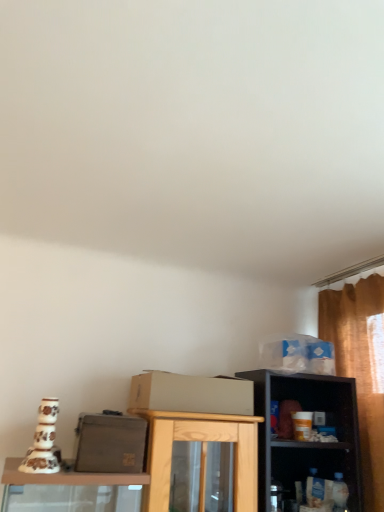
Question: From the image's perspective, is white plastic shelf at lower right positioned above or below beige cardboard box at center?

Choices:
 (A) below
 (B) above

Answer: (A)

Question: From a real-world perspective, relative to beige cardboard box at center, is white plastic shelf at lower right vertically above or below?

Choices:
 (A) below
 (B) above

Answer: (A)

Question: Which object is positioned farthest from the beige cardboard box at center?

Choices:
 (A) blue plastic bag at upper right, placed as the 1th box when sorted from top to bottom
 (B) matte gray box at center, acting as the first box starting from the front
 (C) white plastic shelf at lower right

Answer: (C)

Question: Which object is positioned farthest from the blue plastic bag at upper right, placed as the 1th box when sorted from top to bottom?

Choices:
 (A) white plastic shelf at lower right
 (B) beige cardboard box at center
 (C) matte gray box at center, the first box from the bottom

Answer: (C)